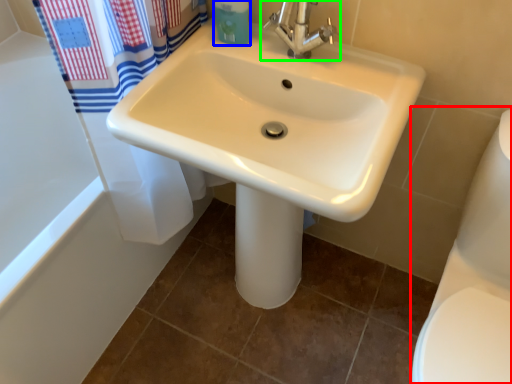
Question: Which is farther away from toilet bowl (highlighted by a red box)? toiletry (highlighted by a blue box) or tap (highlighted by a green box)?

Choices:
 (A) toiletry
 (B) tap

Answer: (A)